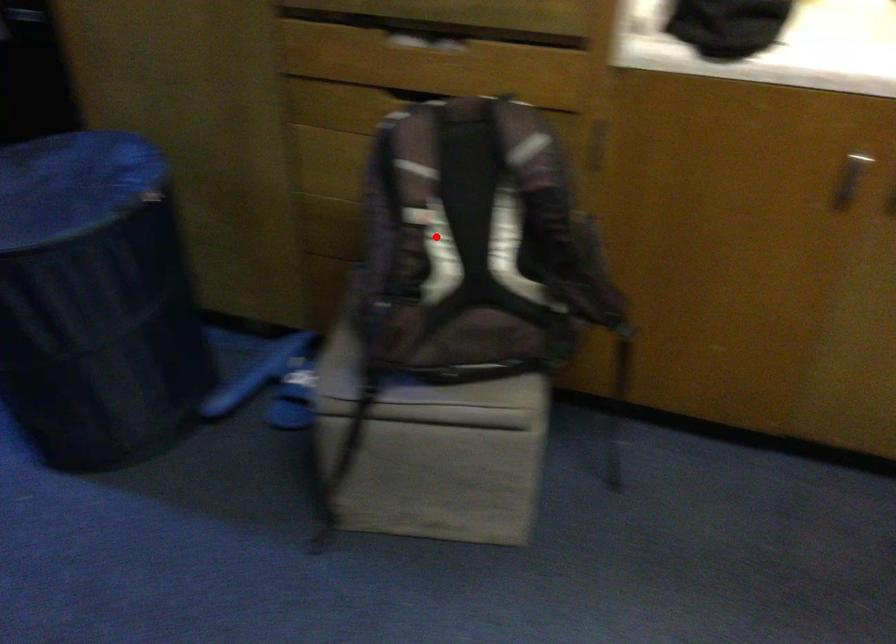
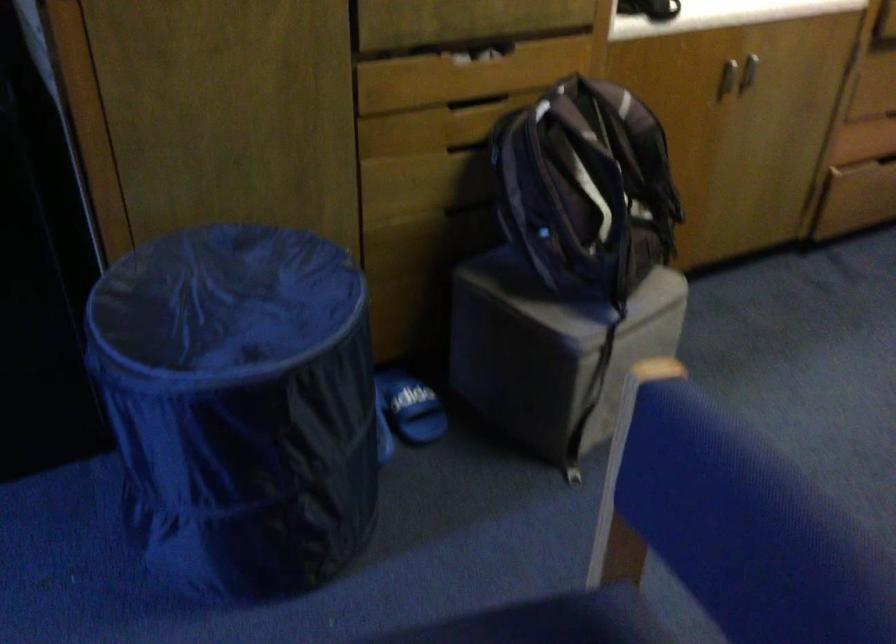
The point at the highlighted location is marked in the first image. Where is the corresponding point in the second image?

(586, 187)